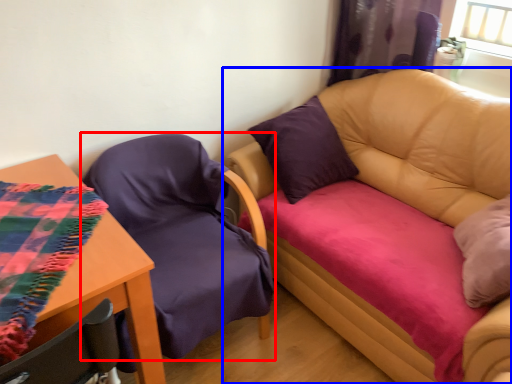
Question: Which point is further to the camera, chair (highlighted by a red box) or studio couch (highlighted by a blue box)?

Choices:
 (A) chair
 (B) studio couch

Answer: (A)